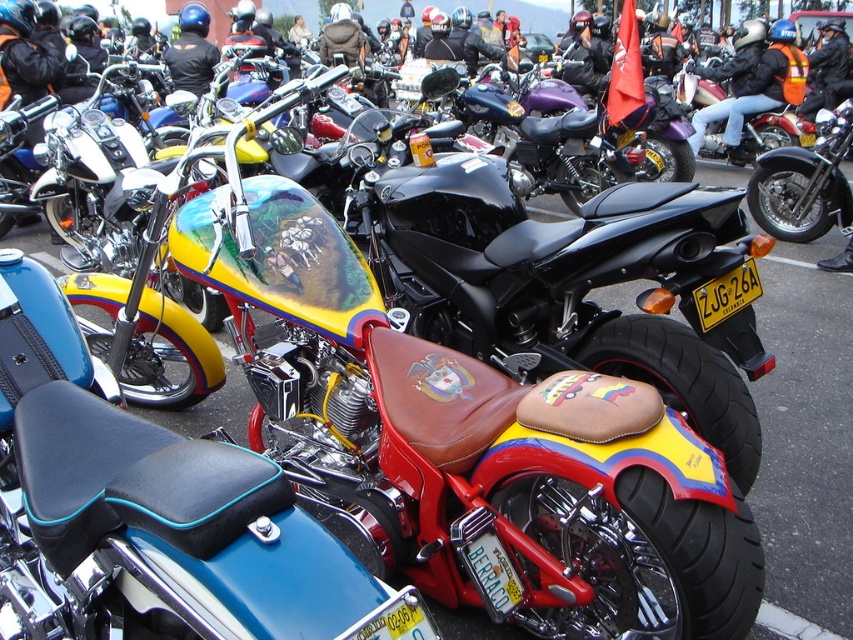
Question: Which point is farther to the camera?

Choices:
 (A) (120, 620)
 (B) (778, 61)

Answer: (B)

Question: Does shiny chrome engine at center come in front of matte black motorcycle at center?

Choices:
 (A) no
 (B) yes

Answer: (B)

Question: Is shiny chrome engine at center bigger than matte black motorcycle at center?

Choices:
 (A) no
 (B) yes

Answer: (A)

Question: Does shiny chrome engine at center have a lesser width compared to matte black motorcycle at center?

Choices:
 (A) no
 (B) yes

Answer: (B)

Question: Which point is farther to the camera?

Choices:
 (A) (762, 88)
 (B) (253, 488)

Answer: (A)